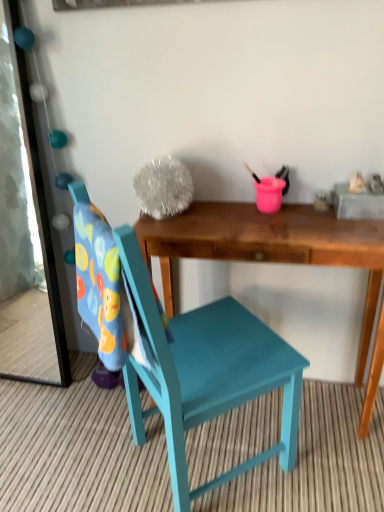
Question: From the image's perspective, is metallic mirror at left located above or below teal painted wood chair at center?

Choices:
 (A) below
 (B) above

Answer: (B)

Question: In terms of width, does metallic mirror at left look wider or thinner when compared to teal painted wood chair at center?

Choices:
 (A) wide
 (B) thin

Answer: (B)

Question: Estimate the real-world distances between objects in this image. Which object is closer to the metallic mirror at left?

Choices:
 (A) teal painted wood chair at center
 (B) wooden desk at center

Answer: (A)

Question: Which object is the farthest from the teal painted wood chair at center?

Choices:
 (A) wooden desk at center
 (B) metallic mirror at left

Answer: (B)